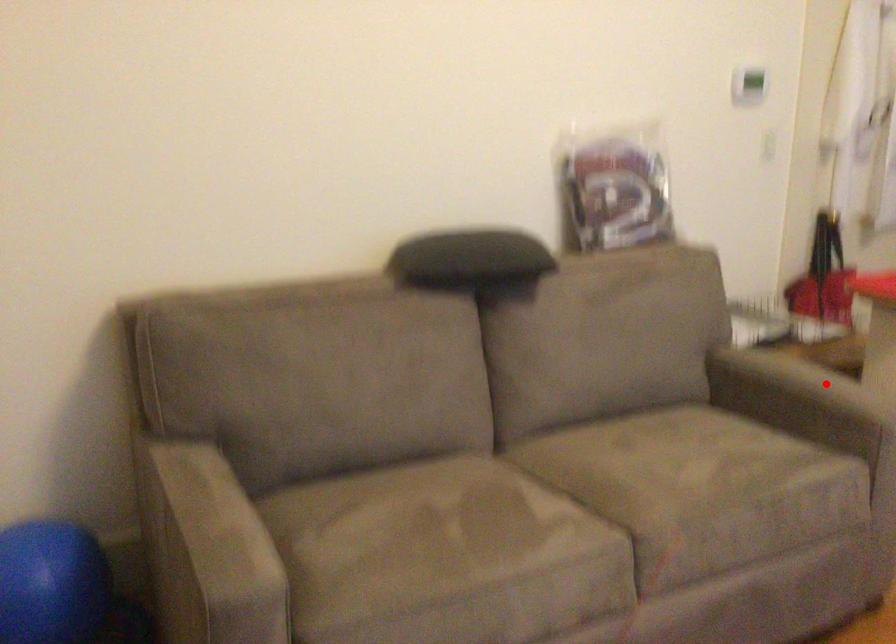
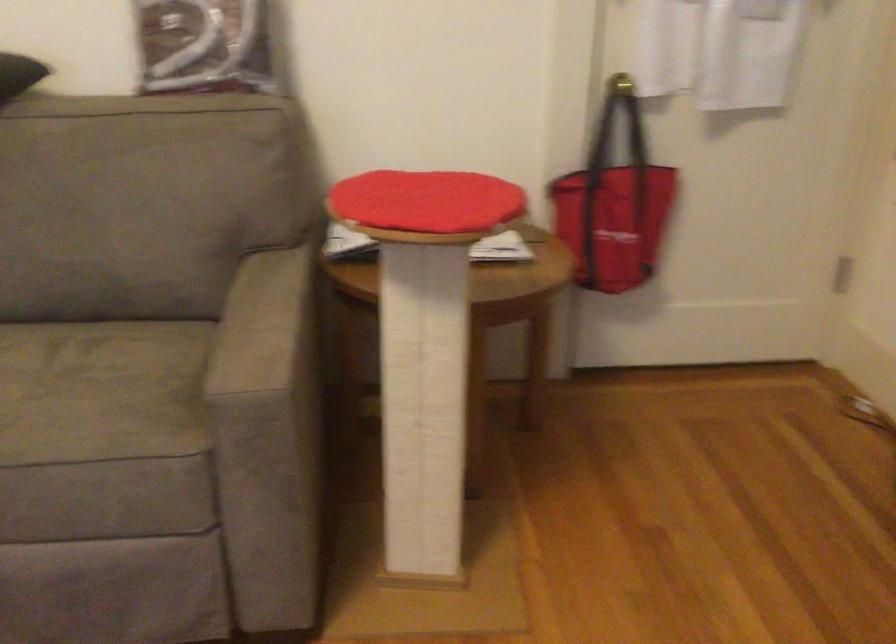
The point at the highlighted location is marked in the first image. Where is the corresponding point in the second image?

(263, 325)